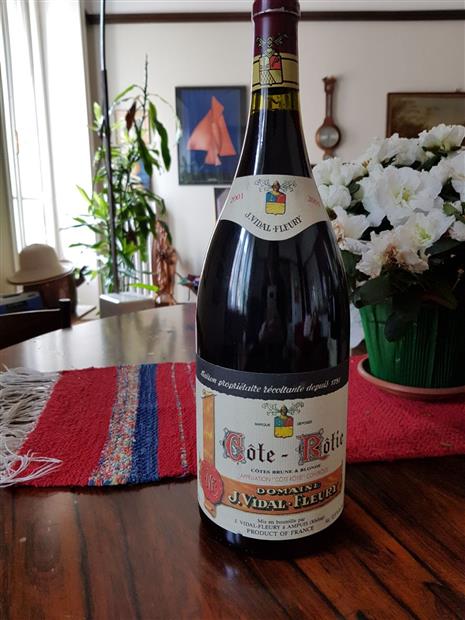
You are a GUI agent. You are given a task and a screenshot of the screen. Output one action in this format:
    pyautogui.click(x=<x>, y=<y>)
    Task: Click on the spindly plant with leaves
    This screenshot has width=465, height=620.
    Given the screenshot: What is the action you would take?
    pyautogui.click(x=115, y=211)